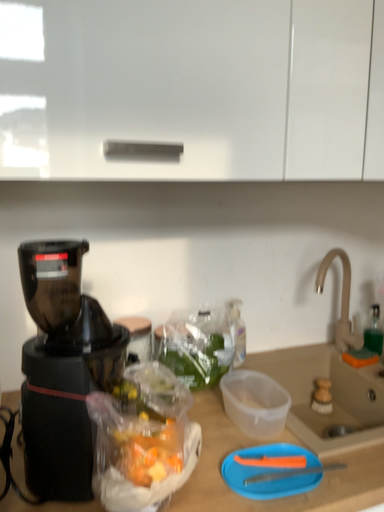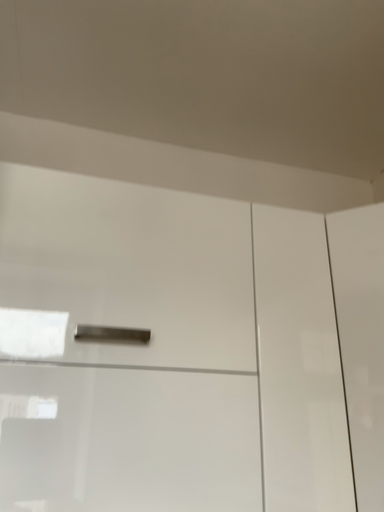
Question: How did the camera likely rotate when shooting the video?

Choices:
 (A) rotated upward
 (B) rotated downward

Answer: (A)